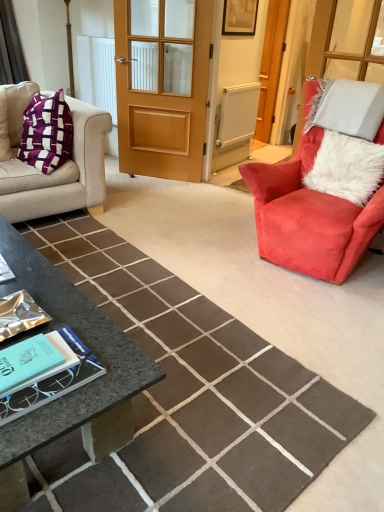
Identify the location of vacant space in front of wooden door at center. (158, 189).